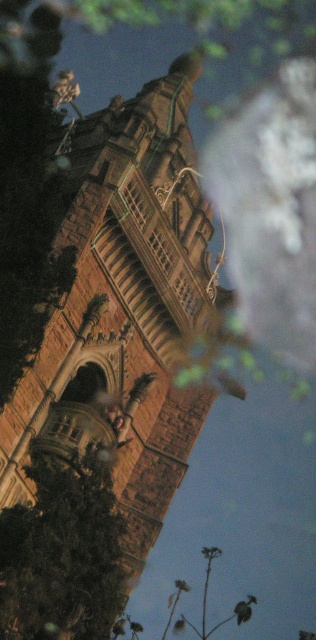
You are standing at the base of the brown stone tower at center and want to take a photo that includes both it and the green leafy tree at lower left. Given their widths, which object should you position closer to the camera to ensure both fit in the frame?

Since the brown stone tower at center is wider than the green leafy tree at lower left, you should position the green leafy tree at lower left closer to the camera to ensure both fit in the frame.